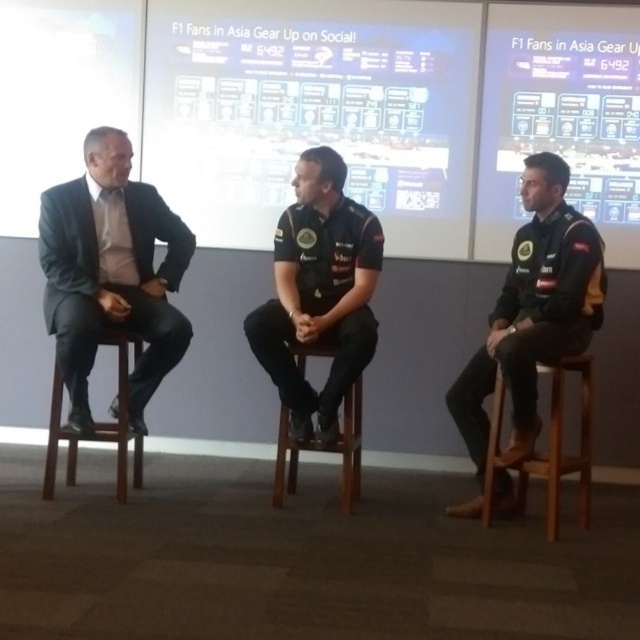
You are an event organizer setting up chairs for a panel discussion. You have two wooden stools, the wooden stool at lower right and the wooden stool at center. According to the image, which stool is placed closer to the audience sitting in front of the stage?

The wooden stool at lower right is positioned under wooden stool at center, so the wooden stool at lower right is closer to the audience since it is placed under the other stool.

You are attending a panel discussion and want to sit on the wooden stool at lower right. Is the black jersey at center blocking your path to the stool?

The black jersey at center is above the wooden stool at lower right, so it is not blocking the path to the stool. You can sit on the wooden stool at lower right without any obstruction.

You are an event photographer at the panel discussion. You need to capture a closeup shot of the black jersey at center without including the wooden stool at lower right in the frame. Is this possible based on their sizes?

The black jersey at center is larger in size than wooden stool at lower right. Since the jersey is bigger, it can potentially cover the stool in the frame if positioned correctly, but this depends on their exact placement. However, since the question is about excluding the stool, the size difference alone doesn